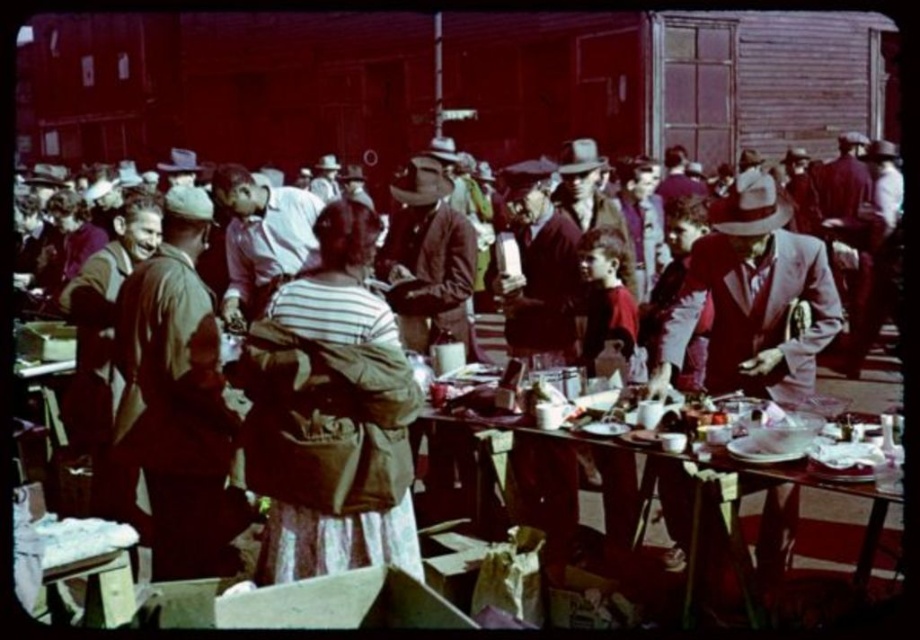
Can you confirm if striped fabric jacket at center is bigger than brown leather jacket at center?

No.

Is striped fabric jacket at center taller than brown leather jacket at center?

Correct, striped fabric jacket at center is much taller as brown leather jacket at center.

Is point (305, 481) positioned in front of point (395, 216)?

Yes, point (305, 481) is closer to viewer.

You are a GUI agent. You are given a task and a screenshot of the screen. Output one action in this format:
    pyautogui.click(x=<x>, y=<y>)
    Task: Click on the striped fabric jacket at center
    This screenshot has width=920, height=640.
    Given the screenshot: What is the action you would take?
    pyautogui.click(x=331, y=413)

Is point (736, 332) positioned before point (797, 573)?

Yes, point (736, 332) is in front of point (797, 573).

Does light purple wool suit at center have a lesser width compared to wooden table at center?

No.

Who is more forward, (684, 314) or (818, 557)?

Point (684, 314)

This screenshot has height=640, width=920. I want to click on light purple wool suit at center, so click(753, 300).

Which is behind, point (397, 433) or point (775, 388)?

The point (775, 388) is more distant.

Describe the element at coordinates (331, 413) in the screenshot. Image resolution: width=920 pixels, height=640 pixels. I see `striped fabric jacket at center` at that location.

Is point (385, 428) positioned after point (720, 388)?

No, (385, 428) is in front of (720, 388).

The image size is (920, 640). I want to click on striped fabric jacket at center, so click(331, 413).